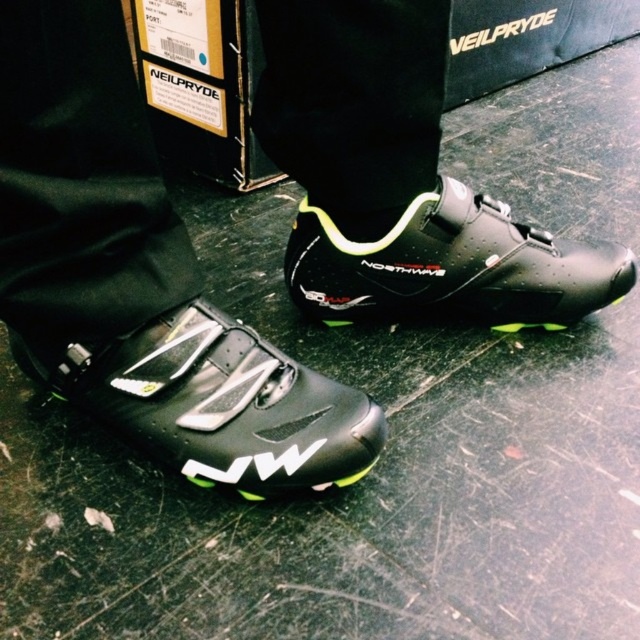
Question: Which point is closer to the camera?

Choices:
 (A) (300, 428)
 (B) (396, 296)

Answer: (A)

Question: Is matte black cycling shoe at lower center thinner than matte black cycling shoe at center?

Choices:
 (A) no
 (B) yes

Answer: (B)

Question: Which point is closer to the camera taking this photo?

Choices:
 (A) [518, 266]
 (B) [298, 401]

Answer: (B)

Question: Is matte black cycling shoe at lower center to the left of matte black cycling shoe at center from the viewer's perspective?

Choices:
 (A) no
 (B) yes

Answer: (B)

Question: Is the position of matte black cycling shoe at lower center less distant than that of matte black cycling shoe at center?

Choices:
 (A) yes
 (B) no

Answer: (A)